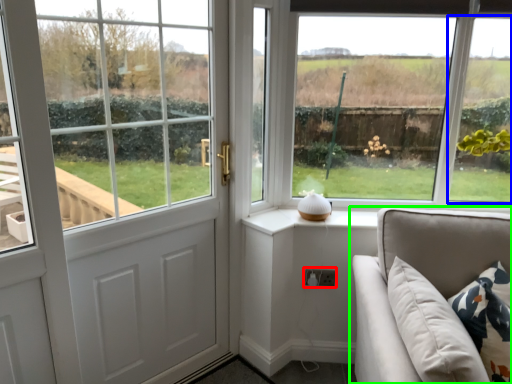
Question: Considering the real-world distances, which object is closest to electric outlet (highlighted by a red box)? window (highlighted by a blue box) or studio couch (highlighted by a green box).

Choices:
 (A) window
 (B) studio couch

Answer: (B)